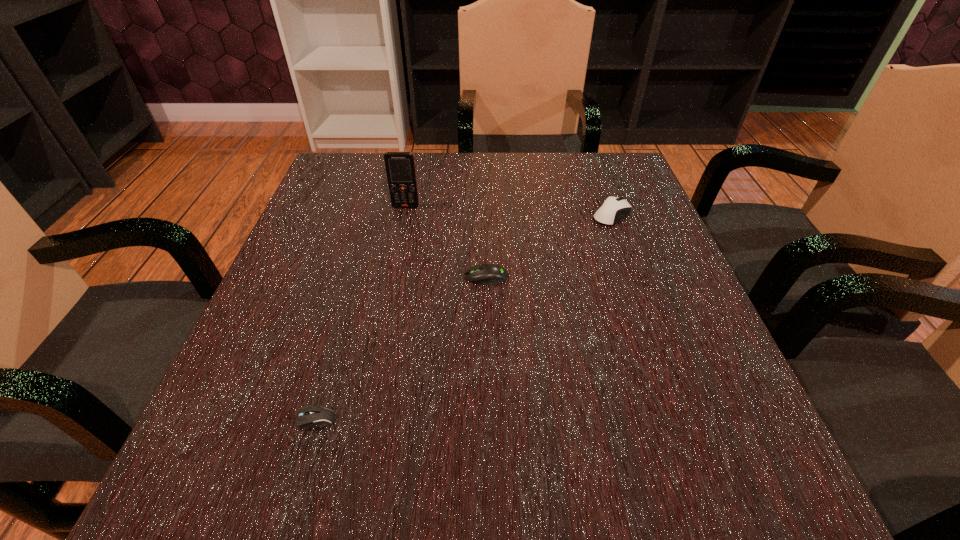
Image resolution: width=960 pixels, height=540 pixels. Identify the location of vacant point located between the second object from right to left and the rightmost computer mouse. (549, 246).

You are a GUI agent. You are given a task and a screenshot of the screen. Output one action in this format:
    pyautogui.click(x=<x>, y=<y>)
    Task: Click on the vacant space that is in between the second farthest computer mouse and the shortest object
    Image resolution: width=960 pixels, height=540 pixels.
    Given the screenshot: What is the action you would take?
    pyautogui.click(x=393, y=357)

Where is `vacant area that lies between the nearest computer mouse and the second object from left to right`? Image resolution: width=960 pixels, height=540 pixels. vacant area that lies between the nearest computer mouse and the second object from left to right is located at coordinates (352, 322).

Where is `vacant area between the leftmost computer mouse and the third shortest object`? vacant area between the leftmost computer mouse and the third shortest object is located at coordinates 456,326.

Identify the location of vacant region between the second object from right to left and the tallest object. The width and height of the screenshot is (960, 540). (446, 242).

Where is `free space between the farthest computer mouse and the third tallest object`? Image resolution: width=960 pixels, height=540 pixels. free space between the farthest computer mouse and the third tallest object is located at coordinates click(549, 246).

Locate an element on the screen. Image resolution: width=960 pixels, height=540 pixels. object that is the nearest to the second computer mouse from left to right is located at coordinates (400, 167).

Point out which object is positioned as the second nearest to the cellular telephone. Please provide its 2D coordinates. Your answer should be formatted as a tuple, i.e. [(x, y)], where the tuple contains the x and y coordinates of a point satisfying the conditions above.

[(613, 209)]

Locate which computer mouse ranks second in proximity to the tallest object. Please provide its 2D coordinates. Your answer should be formatted as a tuple, i.e. [(x, y)], where the tuple contains the x and y coordinates of a point satisfying the conditions above.

[(613, 209)]

Identify which computer mouse is the second closest to the leftmost computer mouse. Please provide its 2D coordinates. Your answer should be formatted as a tuple, i.e. [(x, y)], where the tuple contains the x and y coordinates of a point satisfying the conditions above.

[(613, 209)]